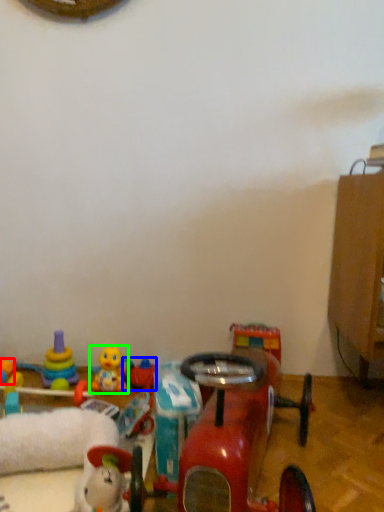
Question: Which is nearer to the toy (highlighted by a red box)? toy (highlighted by a blue box) or toy (highlighted by a green box).

Choices:
 (A) toy
 (B) toy

Answer: (B)